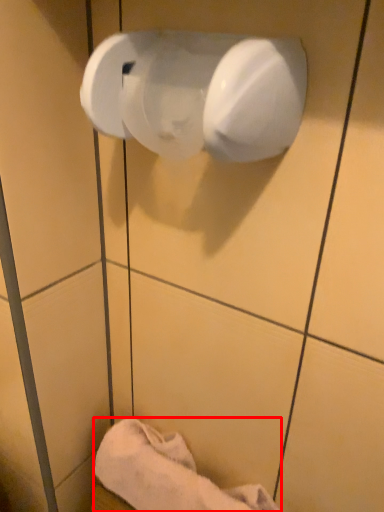
Question: Considering the relative positions of towel (annotated by the red box) and toilet paper in the image provided, where is towel (annotated by the red box) located with respect to the staircase?

Choices:
 (A) left
 (B) right

Answer: (A)